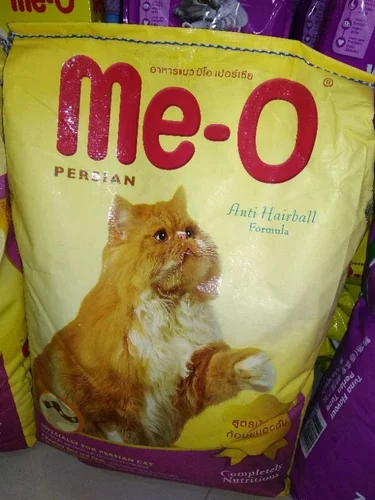
This screenshot has height=500, width=375. I want to click on floor, so click(195, 493).